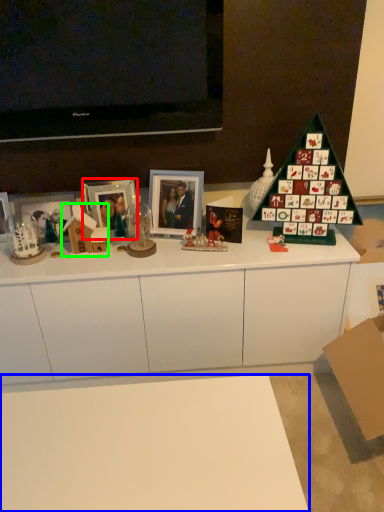
Question: Based on their relative distances, which object is nearer to picture frame (highlighted by a red box)? Choose from desk (highlighted by a blue box) and toy (highlighted by a green box).

Choices:
 (A) desk
 (B) toy

Answer: (B)